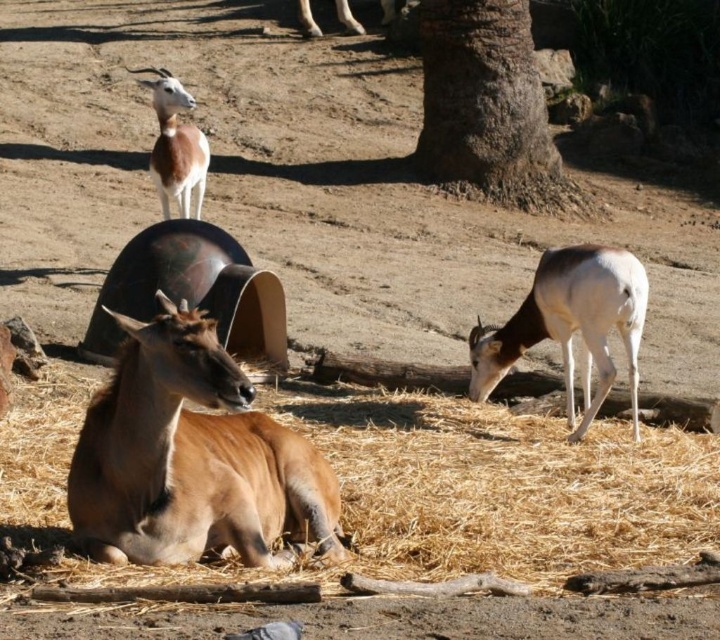
You are a zookeeper planning to place a feeding trough between the white glossy antelope at lower right and the light brown fur antelope at upper left. Considering their sizes, which antelope will have more space on its side of the trough?

The white glossy antelope at lower right has a greater width than the light brown fur antelope at upper left, so it will have more space on its side of the trough.

You are observing the three antelopes in the enclosure. You notice two points marked in the image. The first point is at coordinate point (631, 292) and the second point is at coordinate point (170, 108). Which of these two points is nearer to you?

Point (631, 292) is closer to the viewer than point (170, 108).